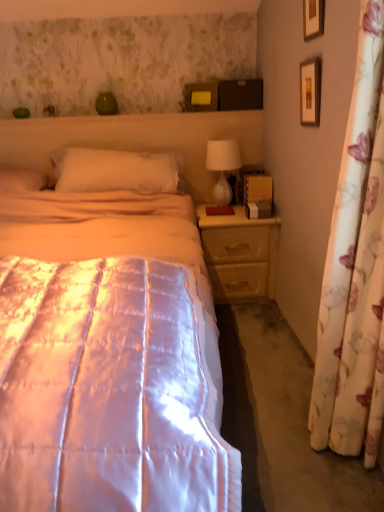
Question: From a real-world perspective, is light wood/texture nightstand at right over floral fabric curtain at right?

Choices:
 (A) yes
 (B) no

Answer: (B)

Question: Considering the relative sizes of light wood/texture nightstand at right and floral fabric curtain at right in the image provided, is light wood/texture nightstand at right wider than floral fabric curtain at right?

Choices:
 (A) no
 (B) yes

Answer: (B)

Question: Is floral fabric curtain at right completely or partially inside light wood/texture nightstand at right?

Choices:
 (A) yes
 (B) no

Answer: (B)

Question: Is light wood/texture nightstand at right positioned far away from floral fabric curtain at right?

Choices:
 (A) no
 (B) yes

Answer: (B)

Question: Is light wood/texture nightstand at right taller than floral fabric curtain at right?

Choices:
 (A) no
 (B) yes

Answer: (A)

Question: Is white glossy table lamp at upper right wider or thinner than light wood/texture nightstand at right?

Choices:
 (A) thin
 (B) wide

Answer: (A)

Question: Considering their positions, is white glossy table lamp at upper right located in front of or behind light wood/texture nightstand at right?

Choices:
 (A) behind
 (B) front

Answer: (A)

Question: Is point (205, 164) positioned closer to the camera than point (258, 253)?

Choices:
 (A) closer
 (B) farther

Answer: (B)

Question: Looking at the image, does white glossy table lamp at upper right seem bigger or smaller compared to light wood/texture nightstand at right?

Choices:
 (A) big
 (B) small

Answer: (B)

Question: From a real-world perspective, is silky white quilt at center above or below floral fabric curtain at right?

Choices:
 (A) above
 (B) below

Answer: (B)

Question: In the image, is silky white quilt at center on the left side or the right side of floral fabric curtain at right?

Choices:
 (A) left
 (B) right

Answer: (A)

Question: Looking at the image, does silky white quilt at center seem bigger or smaller compared to floral fabric curtain at right?

Choices:
 (A) small
 (B) big

Answer: (B)

Question: From the image's perspective, is silky white quilt at center positioned above or below floral fabric curtain at right?

Choices:
 (A) above
 (B) below

Answer: (B)

Question: In terms of size, does white soft pillow at center appear bigger or smaller than white glossy table lamp at upper right?

Choices:
 (A) big
 (B) small

Answer: (A)

Question: Based on their positions, is white soft pillow at center located to the left or right of white glossy table lamp at upper right?

Choices:
 (A) left
 (B) right

Answer: (A)